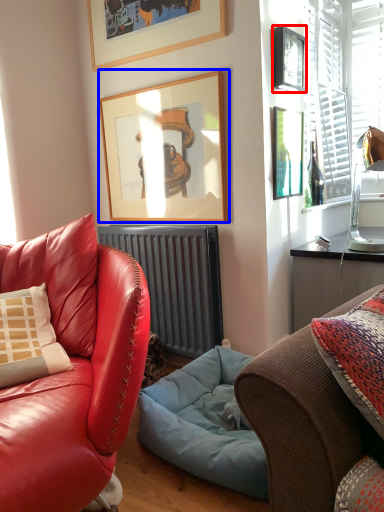
Question: Among these objects, which one is farthest to the camera, picture frame (highlighted by a red box) or picture frame (highlighted by a blue box)?

Choices:
 (A) picture frame
 (B) picture frame

Answer: (B)